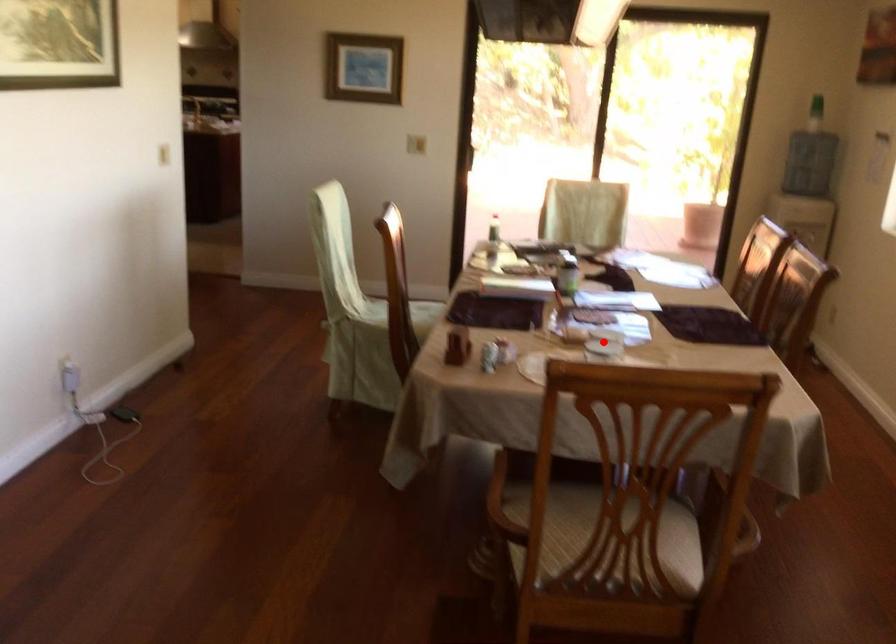
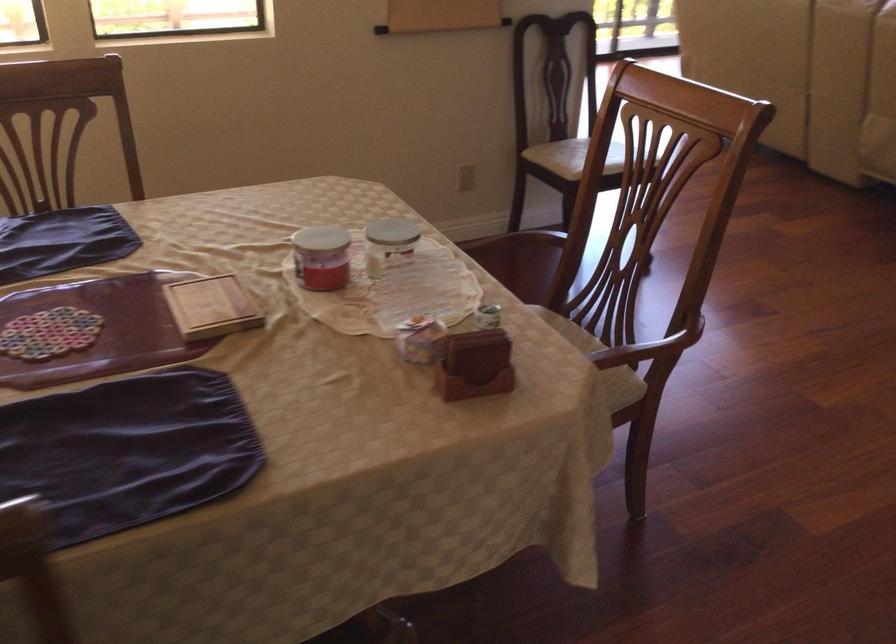
Question: I am providing you with two images of the same scene from different viewpoints. Image1 has a red point marked. In image2, the corresponding 3D location appears at what relative position? Reply with the corresponding letter.

Choices:
 (A) Closer
 (B) Farther

Answer: (A)